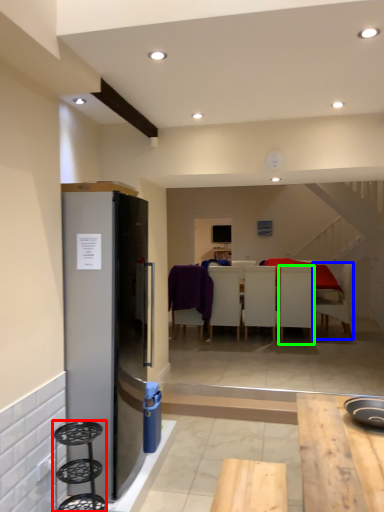
Question: Which is farther away from bar stool (highlighted by a red box)? chair (highlighted by a blue box) or chair (highlighted by a green box)?

Choices:
 (A) chair
 (B) chair

Answer: (A)